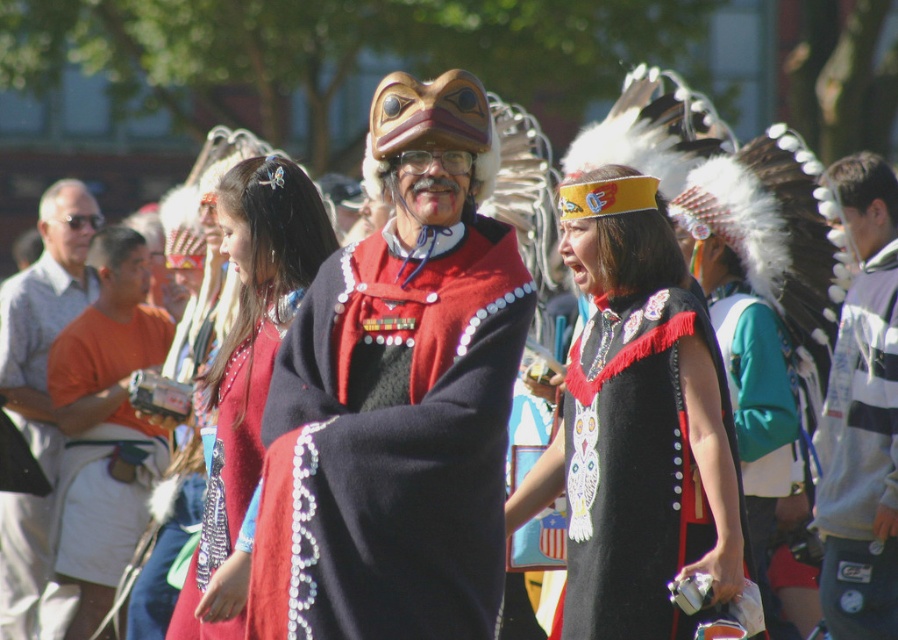
Who is positioned more to the right, velvet red cape at center or orange cotton shirt at left?

Positioned to the right is velvet red cape at center.

Is point (377, 529) farther from camera compared to point (84, 419)?

No, (377, 529) is in front of (84, 419).

Locate an element on the screen. This screenshot has width=898, height=640. velvet red cape at center is located at coordinates (397, 397).

Which is more to the right, black felt cape at center or gray striped shirt at left?

From the viewer's perspective, black felt cape at center appears more on the right side.

Is black felt cape at center to the left of gray striped shirt at left from the viewer's perspective?

In fact, black felt cape at center is to the right of gray striped shirt at left.

I want to click on black felt cape at center, so click(x=637, y=426).

Which is below, velvet red cape at center or matte red dress at center?

velvet red cape at center is below.

Locate an element on the screen. The width and height of the screenshot is (898, 640). velvet red cape at center is located at coordinates (397, 397).